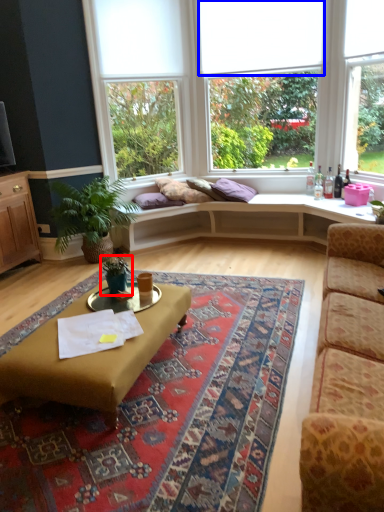
Question: Which object is closer to the camera taking this photo, houseplant (highlighted by a red box) or blind (highlighted by a blue box)?

Choices:
 (A) houseplant
 (B) blind

Answer: (A)